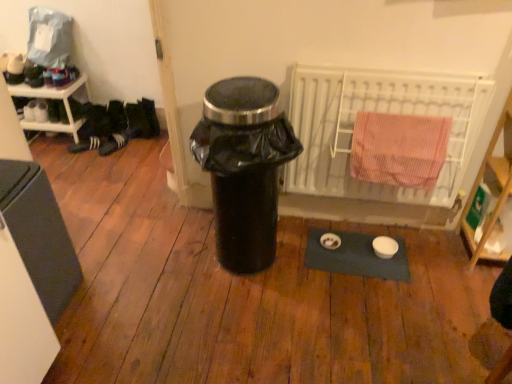
Identify the location of vacant space to the right of matte gray refrigerator at left. (106, 295).